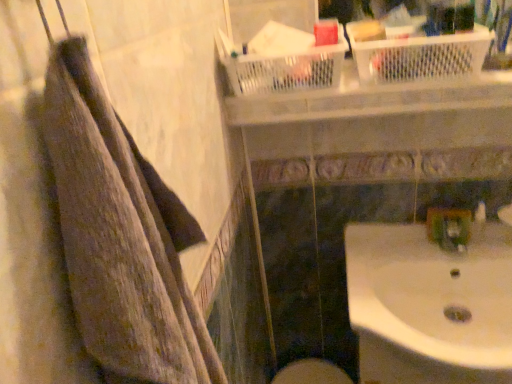
Question: Is green plastic faucet at lower right bigger than white glossy sink at lower right?

Choices:
 (A) yes
 (B) no

Answer: (B)

Question: Is green plastic faucet at lower right beside white glossy sink at lower right?

Choices:
 (A) yes
 (B) no

Answer: (B)

Question: Is green plastic faucet at lower right wider than white glossy sink at lower right?

Choices:
 (A) no
 (B) yes

Answer: (A)

Question: Is green plastic faucet at lower right turned away from white glossy sink at lower right?

Choices:
 (A) yes
 (B) no

Answer: (B)

Question: Does green plastic faucet at lower right appear on the left side of white glossy sink at lower right?

Choices:
 (A) no
 (B) yes

Answer: (A)

Question: Considering the relative positions of green plastic faucet at lower right and white glossy sink at lower right in the image provided, is green plastic faucet at lower right behind white glossy sink at lower right?

Choices:
 (A) no
 (B) yes

Answer: (B)

Question: Does green plastic faucet at lower right come behind brown textured towel at left?

Choices:
 (A) no
 (B) yes

Answer: (B)

Question: From the image's perspective, is green plastic faucet at lower right above brown textured towel at left?

Choices:
 (A) no
 (B) yes

Answer: (A)

Question: Is green plastic faucet at lower right wider than brown textured towel at left?

Choices:
 (A) yes
 (B) no

Answer: (B)

Question: From the image's perspective, would you say green plastic faucet at lower right is shown under brown textured towel at left?

Choices:
 (A) no
 (B) yes

Answer: (B)

Question: Can we say green plastic faucet at lower right lies outside brown textured towel at left?

Choices:
 (A) yes
 (B) no

Answer: (A)

Question: Is green plastic faucet at lower right to the left of brown textured towel at left from the viewer's perspective?

Choices:
 (A) yes
 (B) no

Answer: (B)

Question: Is white glossy sink at lower right outside brown textured towel at left?

Choices:
 (A) yes
 (B) no

Answer: (A)